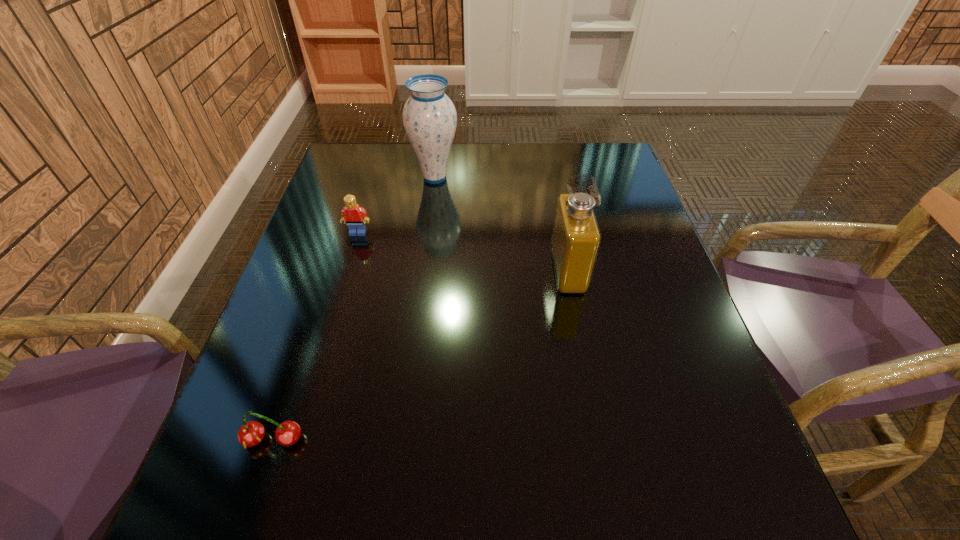
The height and width of the screenshot is (540, 960). Find the location of `free location located on the front-facing side of the third shortest object`. free location located on the front-facing side of the third shortest object is located at coordinates (509, 271).

This screenshot has height=540, width=960. I want to click on vacant space situated 0.320m on the front-facing side of the Lego, so click(325, 343).

This screenshot has width=960, height=540. Find the location of `free space located 0.050m with stems pointing upwards on the shortest object`. free space located 0.050m with stems pointing upwards on the shortest object is located at coordinates (258, 485).

Locate an element on the screen. The width and height of the screenshot is (960, 540). object that is at the far edge is located at coordinates (429, 117).

Image resolution: width=960 pixels, height=540 pixels. I want to click on Lego that is positioned at the left edge, so click(352, 213).

Identify the location of cherry at the left edge. (250, 434).

Identify the location of vacant space at the far edge. (408, 165).

Identify the location of vacant space at the near edge. This screenshot has width=960, height=540. (541, 511).

Locate an element on the screen. The image size is (960, 540). blank area at the left edge is located at coordinates (327, 247).

Locate an element on the screen. Image resolution: width=960 pixels, height=540 pixels. vacant region at the right edge of the desktop is located at coordinates (641, 392).